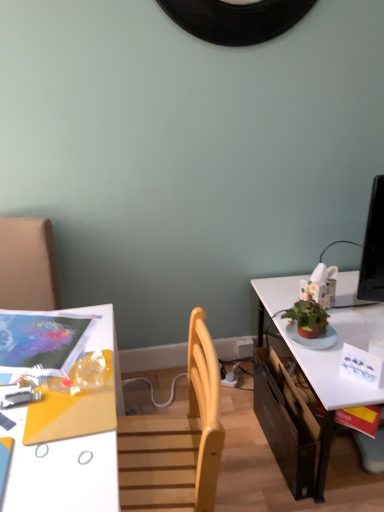
This screenshot has height=512, width=384. Describe the element at coordinates (286, 423) in the screenshot. I see `black cardboard drawer at lower right` at that location.

Locate an element on the screen. The height and width of the screenshot is (512, 384). white glossy table at right is located at coordinates (338, 364).

In order to face white glossy desk at lower left, should I rotate leftwards or rightwards?

To align with it, rotate left about 19.503°.

Locate an element on the screen. This screenshot has width=384, height=512. black cardboard drawer at lower right is located at coordinates (286, 423).

From the picture: Can you confirm if white glossy desk at lower left is thinner than white glossy table at right?

Yes.

Is white glossy desk at lower left positioned behind white glossy table at right?

No, it is in front of white glossy table at right.

Which point is more distant from viewer, (20, 489) or (306, 359)?

The point (306, 359) is more distant.

Which is more to the left, white glossy desk at lower left or white glossy table at right?

white glossy desk at lower left is more to the left.

From a real-world perspective, is black cardboard drawer at lower right on white glossy desk at lower left?

No.

Based on their sizes in the image, would you say black cardboard drawer at lower right is bigger or smaller than white glossy desk at lower left?

Clearly, black cardboard drawer at lower right is smaller in size than white glossy desk at lower left.

From the image's perspective, is black cardboard drawer at lower right positioned above or below white glossy desk at lower left?

From the image's perspective, black cardboard drawer at lower right appears above white glossy desk at lower left.

Which point is more distant from viewer, (316, 455) or (89, 499)?

The point (316, 455) is more distant.

Which point is more distant from viewer, (x=24, y=331) or (x=8, y=474)?

Positioned behind is point (x=24, y=331).

Identify the location of magazine above the white glossy desk at lower left (from the image's perspective). The height and width of the screenshot is (512, 384). (42, 341).

Is matte plastic magazine at upper left positioned far away from white glossy desk at lower left?

No, there isn't a large distance between matte plastic magazine at upper left and white glossy desk at lower left.

Considering the sizes of objects matte plastic magazine at upper left and white glossy desk at lower left in the image provided, who is shorter, matte plastic magazine at upper left or white glossy desk at lower left?

With less height is matte plastic magazine at upper left.

Is the depth of white glossy desk at lower left less than that of matte plastic magazine at upper left?

Yes, white glossy desk at lower left is closer to the viewer.

Based on the photo, from a real-world perspective, who is located lower, white glossy desk at lower left or matte plastic magazine at upper left?

white glossy desk at lower left is physically lower.

Is white glossy desk at lower left positioned with its back to matte plastic magazine at upper left?

That's not correct — white glossy desk at lower left is not looking away from matte plastic magazine at upper left.

Which point is more forward, (38,461) or (83,344)?

The point (38,461) is closer.

Between black cardboard drawer at lower right and white glossy table at right, which one is positioned in front?

white glossy table at right is closer to the camera.

Does black cardboard drawer at lower right appear on the right side of white glossy table at right?

No.

Consider the image. Considering the sizes of objects black cardboard drawer at lower right and white glossy table at right in the image provided, who is smaller, black cardboard drawer at lower right or white glossy table at right?

black cardboard drawer at lower right is smaller.

From a real-world perspective, is black cardboard drawer at lower right positioned over white glossy table at right based on gravity?

No.

Does point (272, 397) come closer to viewer compared to point (8, 352)?

No, it is behind (8, 352).

Is black cardboard drawer at lower right turned away from matte plastic magazine at upper left?

black cardboard drawer at lower right is not turned away from matte plastic magazine at upper left.

From the image's perspective, is black cardboard drawer at lower right beneath matte plastic magazine at upper left?

Correct, black cardboard drawer at lower right appears lower than matte plastic magazine at upper left in the image.

What's the angular difference between black cardboard drawer at lower right and matte plastic magazine at upper left's facing directions?

72.9 degrees.

Is white glossy table at right inside the boundaries of matte plastic magazine at upper left, or outside?

white glossy table at right is not inside matte plastic magazine at upper left, it's outside.

From a real-world perspective, who is located higher, white glossy table at right or matte plastic magazine at upper left?

matte plastic magazine at upper left, from a real-world perspective.

Between white glossy table at right and matte plastic magazine at upper left, which one has larger width?

Wider between the two is white glossy table at right.

Considering the sizes of white glossy table at right and matte plastic magazine at upper left in the image, is white glossy table at right bigger or smaller than matte plastic magazine at upper left?

Considering their sizes, white glossy table at right takes up more space than matte plastic magazine at upper left.

Find the location of `desk above the white glossy table at right (from a real-world perspective)`. desk above the white glossy table at right (from a real-world perspective) is located at coordinates (61, 472).

Find the location of a particular element. Image resolution: width=384 pixels, height=512 pixels. drawer that appears below the white glossy desk at lower left (from a real-world perspective) is located at coordinates (286, 423).

When comparing their distances from white glossy desk at lower left, does matte plastic magazine at upper left or black cardboard drawer at lower right seem closer?

matte plastic magazine at upper left is positioned closer to the anchor white glossy desk at lower left.

Based on their spatial positions, is white glossy desk at lower left or matte plastic magazine at upper left further from black cardboard drawer at lower right?

Based on the image, matte plastic magazine at upper left appears to be further to black cardboard drawer at lower right.

From the image, which object appears to be nearer to matte plastic magazine at upper left, white glossy table at right or black cardboard drawer at lower right?

black cardboard drawer at lower right.

Considering their positions, is white glossy desk at lower left positioned closer to white glossy table at right than matte plastic magazine at upper left?

white glossy desk at lower left is positioned closer to the anchor white glossy table at right.

When comparing their distances from white glossy table at right, does matte plastic magazine at upper left or black cardboard drawer at lower right seem closer?

black cardboard drawer at lower right.

Considering their positions, is black cardboard drawer at lower right positioned closer to white glossy desk at lower left than white glossy table at right?

Among the two, black cardboard drawer at lower right is located nearer to white glossy desk at lower left.

Which object lies nearer to the anchor point white glossy table at right, black cardboard drawer at lower right or white glossy desk at lower left?

The object closer to white glossy table at right is black cardboard drawer at lower right.

When comparing their distances from matte plastic magazine at upper left, does white glossy table at right or white glossy desk at lower left seem closer?

white glossy desk at lower left is closer to matte plastic magazine at upper left.

Find the location of a particular element. The image size is (384, 512). drawer between matte plastic magazine at upper left and white glossy table at right is located at coordinates (286, 423).

Image resolution: width=384 pixels, height=512 pixels. What are the coordinates of `drawer between white glossy desk at lower left and white glossy table at right from left to right` in the screenshot? It's located at (286, 423).

Where is `desk between matte plastic magazine at upper left and white glossy table at right in the horizontal direction`? This screenshot has height=512, width=384. desk between matte plastic magazine at upper left and white glossy table at right in the horizontal direction is located at coordinates (61, 472).

The image size is (384, 512). In order to click on desk between matte plastic magazine at upper left and black cardboard drawer at lower right from left to right in this screenshot , I will do `click(61, 472)`.